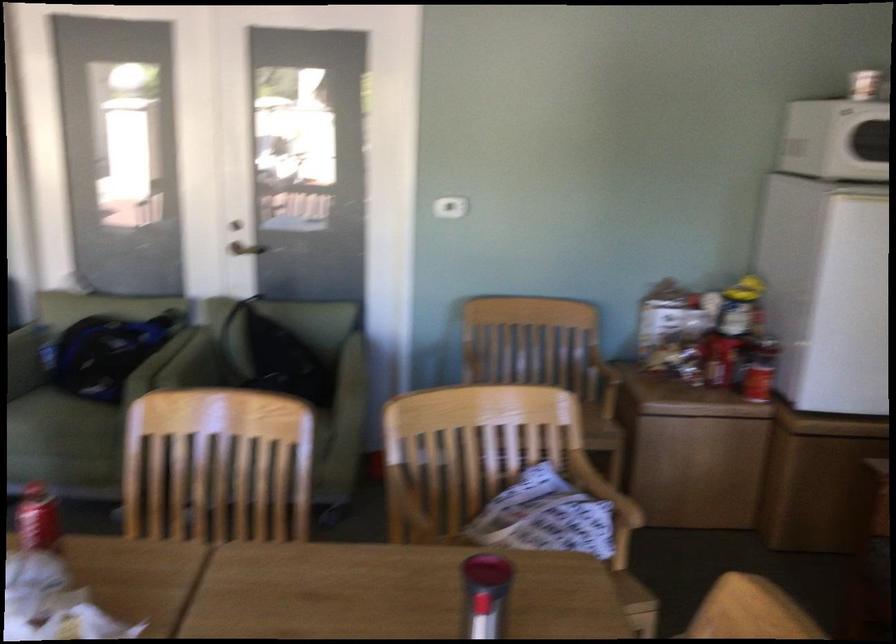
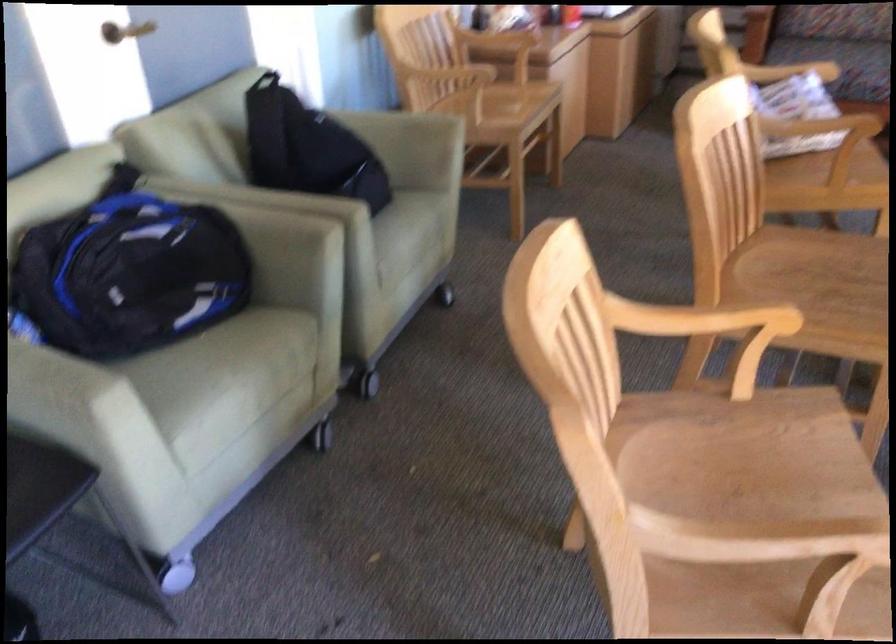
Find the pixel in the second image that matches [125,380] in the first image.

(289, 232)